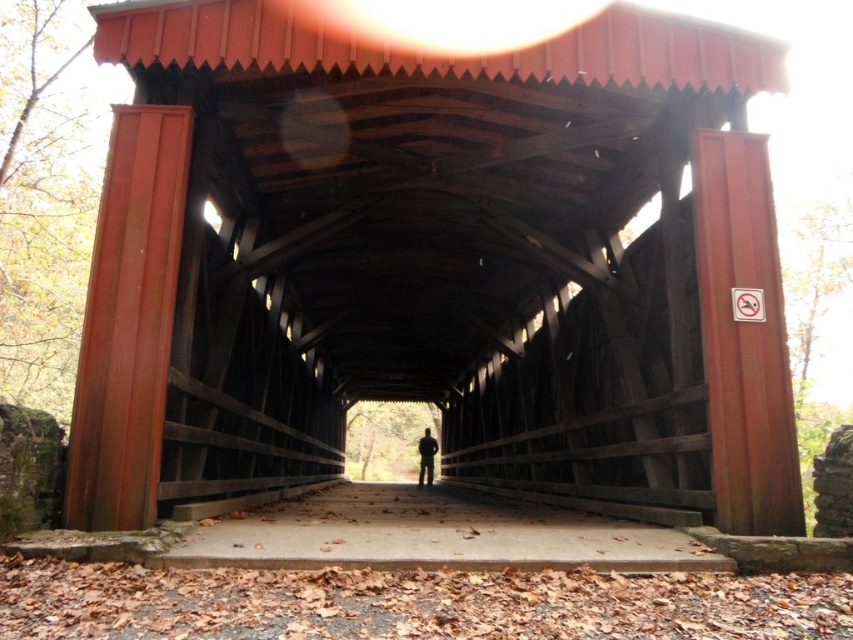
Between matte wood bridge at center and silhouette fabric at center, which one appears on the left side from the viewer's perspective?

matte wood bridge at center

This screenshot has height=640, width=853. What do you see at coordinates (434, 264) in the screenshot?
I see `matte wood bridge at center` at bounding box center [434, 264].

Measure the distance between point (567, 227) and camera.

They are 10.44 meters apart.

This screenshot has height=640, width=853. What are the coordinates of `matte wood bridge at center` in the screenshot? It's located at (434, 264).